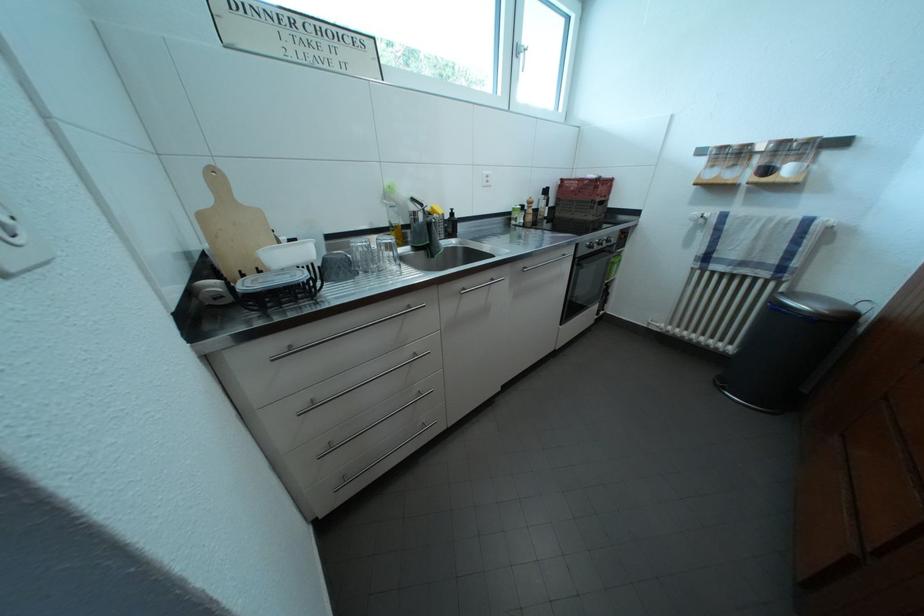
Describe the element at coordinates (590, 245) in the screenshot. I see `the black oven knob` at that location.